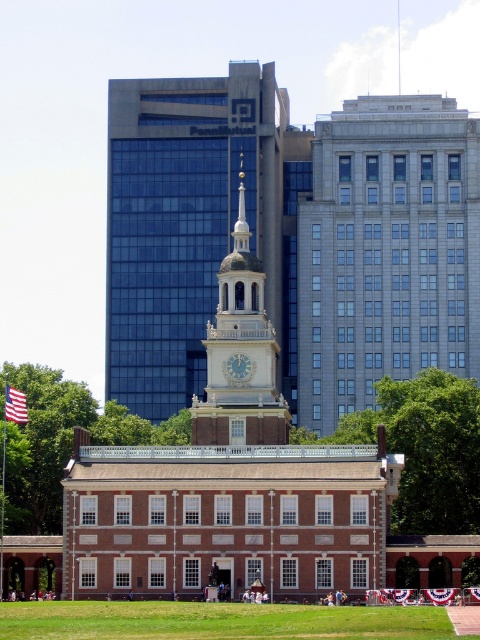
Is point (252, 381) closer to camera compared to point (22, 403)?

That is False.

Does point (240, 348) come farther from viewer compared to point (4, 406)?

Yes, point (240, 348) is farther from viewer.

Is point (253, 296) positioned before point (12, 410)?

No, (253, 296) is behind (12, 410).

Identify the location of light brown stone clock tower at center. (242, 353).

Does green leafy tree at center have a greater width compared to green leafy tree at lower left?

In fact, green leafy tree at center might be narrower than green leafy tree at lower left.

Looking at this image, is green leafy tree at center above green leafy tree at lower left?

Incorrect, green leafy tree at center is not positioned above green leafy tree at lower left.

You are a GUI agent. You are given a task and a screenshot of the screen. Output one action in this format:
    pyautogui.click(x=<x>, y=<y>)
    Task: Click on the green leafy tree at center
    Image resolution: width=480 pixels, height=640 pixels.
    Given the screenshot: What is the action you would take?
    pyautogui.click(x=422, y=449)

Locate an element on the screen. The width and height of the screenshot is (480, 640). green leafy tree at center is located at coordinates (422, 449).

Can you confirm if gray stone clock tower at center is positioned to the right of white glossy clock at center?

Correct, you'll find gray stone clock tower at center to the right of white glossy clock at center.

What are the coordinates of `gray stone clock tower at center` in the screenshot? It's located at (385, 250).